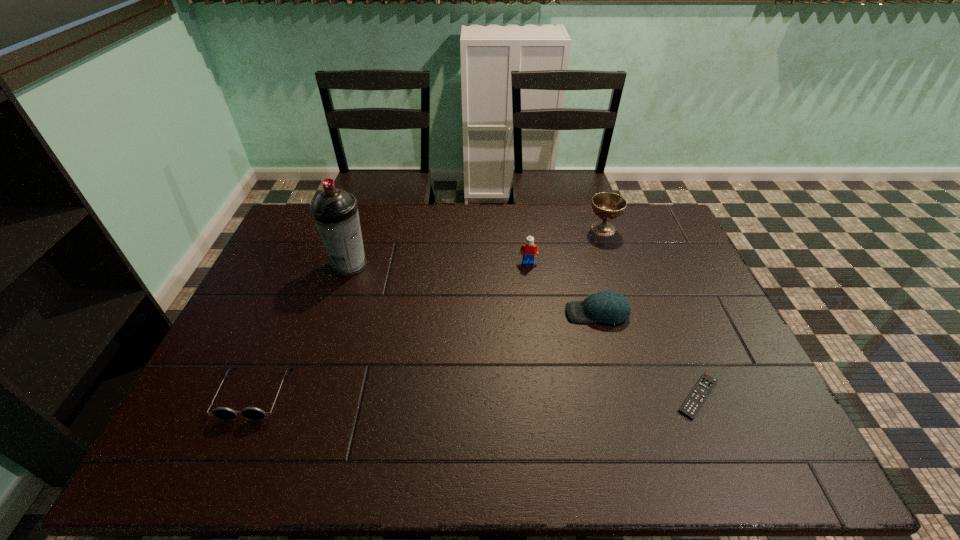
Where is `vacant region located on the right of the fourth farthest object`? vacant region located on the right of the fourth farthest object is located at coordinates (646, 313).

Locate an element on the screen. vacant region located 0.070m on the front-facing side of the fifth tallest object is located at coordinates (230, 450).

Where is `vacant space located 0.200m on the left of the shortest object`? Image resolution: width=960 pixels, height=540 pixels. vacant space located 0.200m on the left of the shortest object is located at coordinates (592, 396).

Locate an element on the screen. The image size is (960, 540). object located at the far edge is located at coordinates (607, 206).

Where is `object that is at the left edge`? Image resolution: width=960 pixels, height=540 pixels. object that is at the left edge is located at coordinates (224, 413).

Where is `object at the right edge`? The height and width of the screenshot is (540, 960). object at the right edge is located at coordinates (702, 389).

In the image, there is a desktop. Identify the location of free space at the far edge. pos(532,205).

The height and width of the screenshot is (540, 960). Identify the location of vacant space at the near edge. (405, 438).

Where is `free space at the left edge of the desktop`? This screenshot has width=960, height=540. free space at the left edge of the desktop is located at coordinates (273, 362).

The width and height of the screenshot is (960, 540). In order to click on vacant space at the right edge of the desktop in this screenshot , I will do `click(686, 352)`.